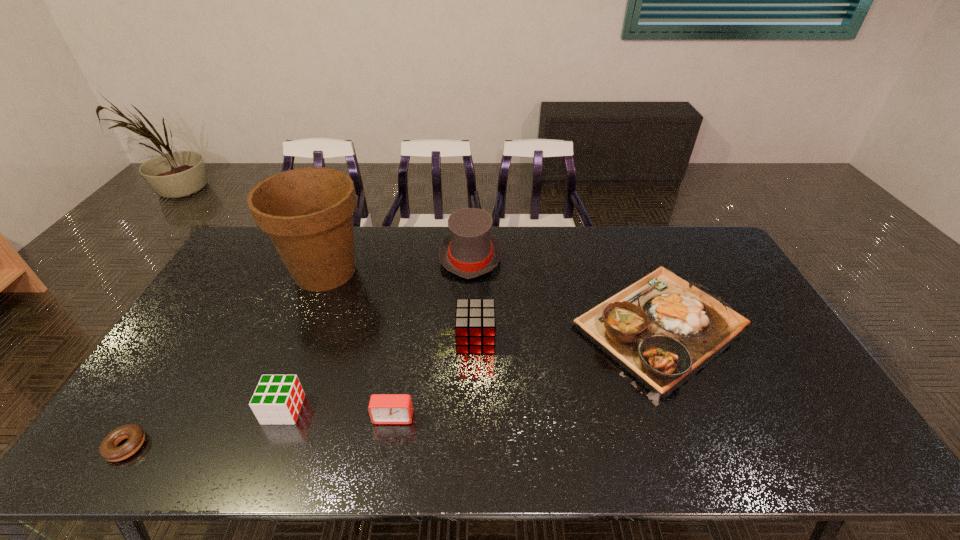
Find the location of a particular element. The width and height of the screenshot is (960, 540). blank area located on the back of the flowerpot is located at coordinates (343, 228).

This screenshot has height=540, width=960. In order to click on vacant space located 0.320m on the left of the second tallest object in this screenshot , I will do `click(350, 257)`.

The image size is (960, 540). Identify the location of free space located 0.300m on the right of the farther cube. (597, 339).

At what (x,y) coordinates should I click in order to perform the action: click on vacant space located on the left of the rightmost object. Please return your answer as a coordinate pair (x, y). The image size is (960, 540). Looking at the image, I should click on (452, 326).

Find the location of a particular element. The height and width of the screenshot is (540, 960). free space located on the red face of the nearer cube is located at coordinates (344, 409).

Locate an element on the screen. vacant area situated 0.360m on the back of the nearest object is located at coordinates pos(206,321).

Locate an element on the screen. The width and height of the screenshot is (960, 540). flowerpot located in the far edge section of the desktop is located at coordinates (307, 212).

I want to click on dress hat that is at the far edge, so click(x=469, y=251).

Image resolution: width=960 pixels, height=540 pixels. Find the location of `object present at the near edge`. object present at the near edge is located at coordinates (108, 449).

Where is `object that is at the left edge`? This screenshot has width=960, height=540. object that is at the left edge is located at coordinates (108, 449).